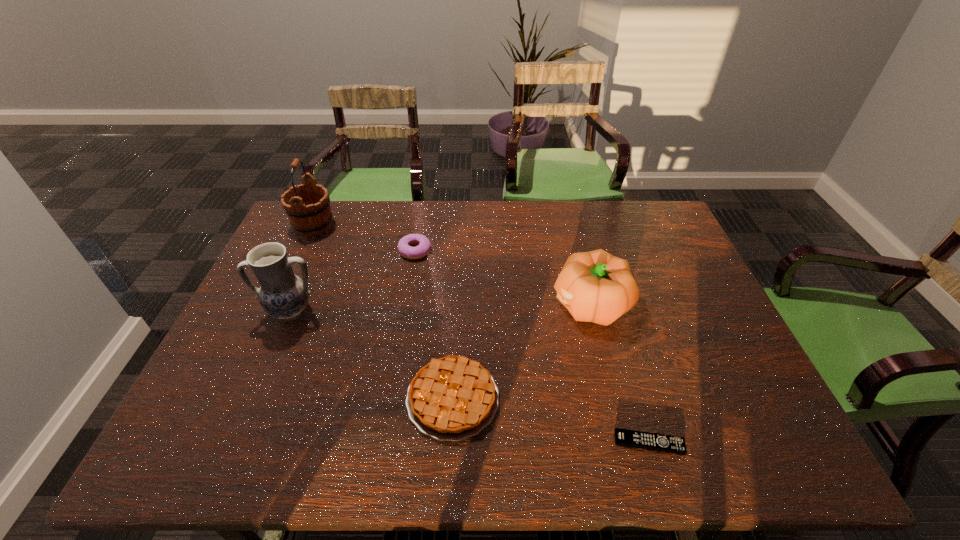
This screenshot has height=540, width=960. Find the location of `vacant point that satisfies the following two spatial constraints: 1. on the front side of the shortest object; 2. on the left side of the doughnut`. vacant point that satisfies the following two spatial constraints: 1. on the front side of the shortest object; 2. on the left side of the doughnut is located at coordinates (383, 443).

You are a GUI agent. You are given a task and a screenshot of the screen. Output one action in this format:
    pyautogui.click(x=<x>, y=<y>)
    Task: Click on the free space that satisfies the following two spatial constraints: 1. on the carved face of the pumpkin; 2. on the left side of the shortest object
    The height and width of the screenshot is (540, 960).
    Given the screenshot: What is the action you would take?
    pyautogui.click(x=625, y=443)